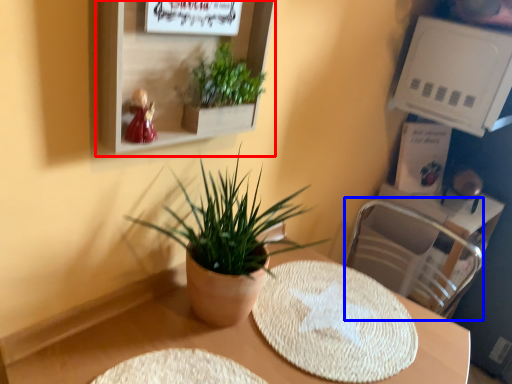
Question: Which point is closer to the camera, shelf (highlighted by a red box) or swivel chair (highlighted by a blue box)?

Choices:
 (A) shelf
 (B) swivel chair

Answer: (A)